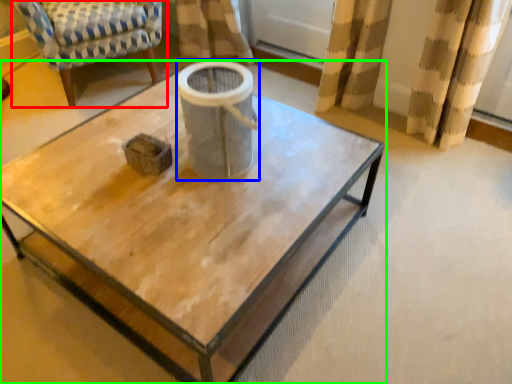
Question: Which is nearer to the chair (highlighted by a red box)? gray (highlighted by a blue box) or coffee table (highlighted by a green box).

Choices:
 (A) gray
 (B) coffee table

Answer: (B)